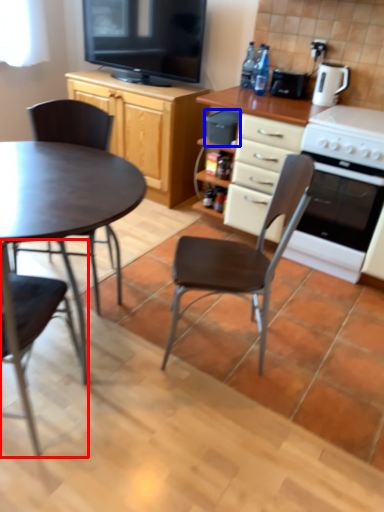
Question: Among these objects, which one is farthest to the camera, chair (highlighted by a red box) or appliance (highlighted by a blue box)?

Choices:
 (A) chair
 (B) appliance

Answer: (B)